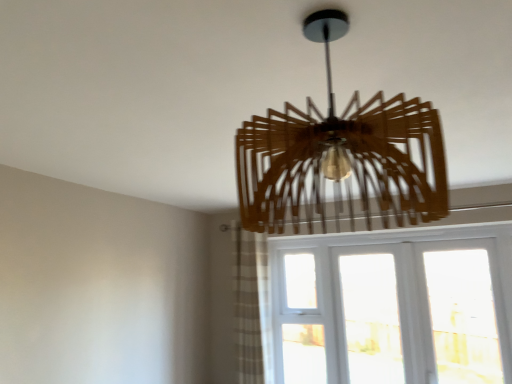
Question: Is plaid fabric curtain at lower center to the left or to the right of wooden chandelier at center in the image?

Choices:
 (A) right
 (B) left

Answer: (B)

Question: Is plaid fabric curtain at lower center inside or outside of wooden chandelier at center?

Choices:
 (A) outside
 (B) inside

Answer: (A)

Question: Which of these objects is positioned closest to the white textured glass at lower right?

Choices:
 (A) wooden chandelier at center
 (B) plaid fabric curtain at lower center

Answer: (B)

Question: Which object is the closest to the wooden chandelier at center?

Choices:
 (A) white textured glass at lower right
 (B) plaid fabric curtain at lower center

Answer: (B)